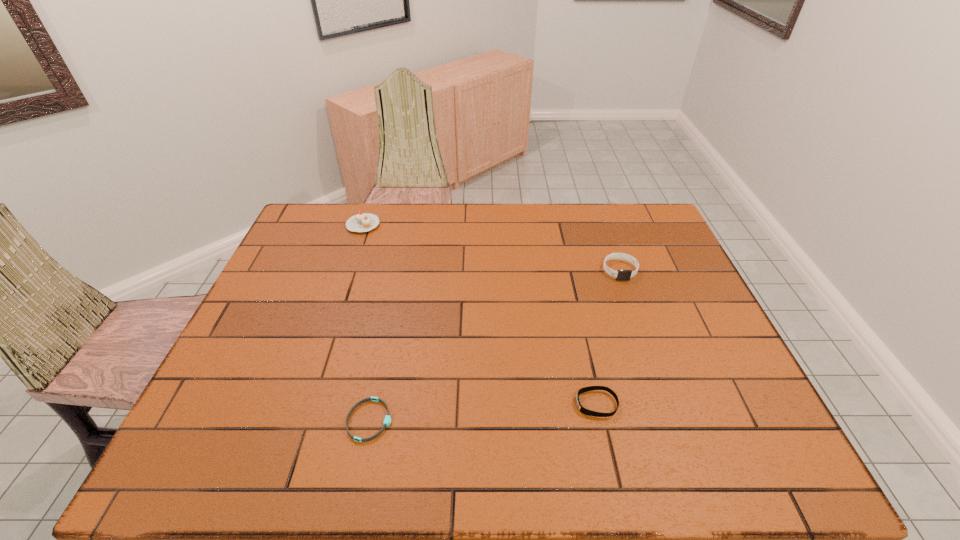
Where is `unoccupied position between the second object from right to left and the shortest object`? This screenshot has height=540, width=960. unoccupied position between the second object from right to left and the shortest object is located at coordinates (483, 412).

Where is `free space between the cupcake and the shortest object`? The height and width of the screenshot is (540, 960). free space between the cupcake and the shortest object is located at coordinates (367, 322).

Identify the location of empty space between the farthest wristband and the farthest object. (492, 247).

At what (x,y) coordinates should I click in order to perform the action: click on object that is the closest one to the shortest object. Please return your answer as a coordinate pair (x, y). Image resolution: width=960 pixels, height=540 pixels. Looking at the image, I should click on (x=583, y=410).

In order to click on the closest object to the second farthest object in this screenshot , I will do `click(583, 410)`.

Locate an element on the screen. This screenshot has width=960, height=540. wristband object that ranks as the closest to the third tallest object is located at coordinates (622, 275).

Locate an element on the screen. This screenshot has width=960, height=540. wristband identified as the second closest to the second shortest wristband is located at coordinates (387, 420).

Where is `free space that satisfies the following two spatial constraints: 1. on the outer surface of the farthest wristband; 2. on the buckle of the shortest object`? The width and height of the screenshot is (960, 540). free space that satisfies the following two spatial constraints: 1. on the outer surface of the farthest wristband; 2. on the buckle of the shortest object is located at coordinates (673, 420).

Locate an element on the screen. This screenshot has height=540, width=960. vacant space that satisfies the following two spatial constraints: 1. on the outer surface of the second farthest object; 2. on the display of the second tallest wristband is located at coordinates (667, 404).

Locate an element on the screen. Image resolution: width=960 pixels, height=540 pixels. free region that satisfies the following two spatial constraints: 1. on the outer surface of the rightmost wristband; 2. on the display of the second object from right to left is located at coordinates (667, 404).